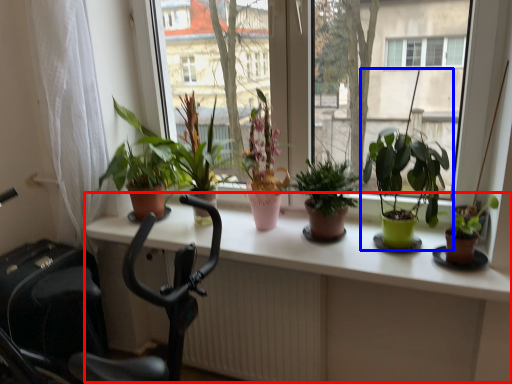
Question: Which object is further to the camera taking this photo, table (highlighted by a red box) or houseplant (highlighted by a blue box)?

Choices:
 (A) table
 (B) houseplant

Answer: (B)